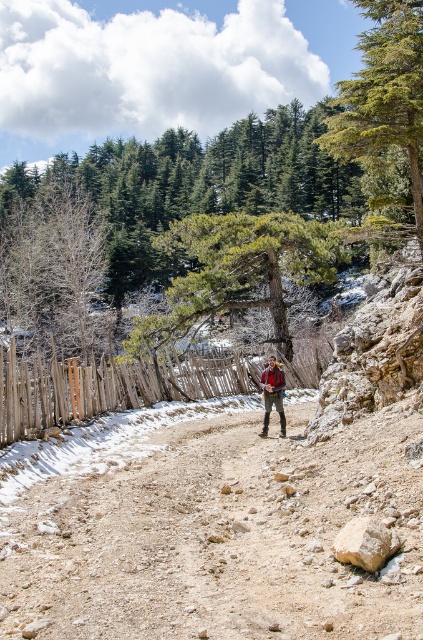
Who is more forward, (211, 316) or (264, 428)?

Point (264, 428) is more forward.

Which is below, green textured pine tree at center or camouflage fabric backpack at center?

camouflage fabric backpack at center is lower down.

Locate an element on the screen. The height and width of the screenshot is (640, 423). green textured pine tree at center is located at coordinates (238, 272).

Is dusty gravel path at center below wooden at center?

Actually, dusty gravel path at center is above wooden at center.

Who is more forward, (346, 461) or (101, 408)?

Point (346, 461) is more forward.

Find the location of a particular element. The image size is (423, 640). dusty gravel path at center is located at coordinates (220, 538).

Does green textured tree at upper right appear under camouflage fabric backpack at center?

No, green textured tree at upper right is not below camouflage fabric backpack at center.

Which of these two, green textured tree at upper right or camouflage fabric backpack at center, stands taller?

Standing taller between the two is green textured tree at upper right.

I want to click on green textured tree at upper right, so click(384, 92).